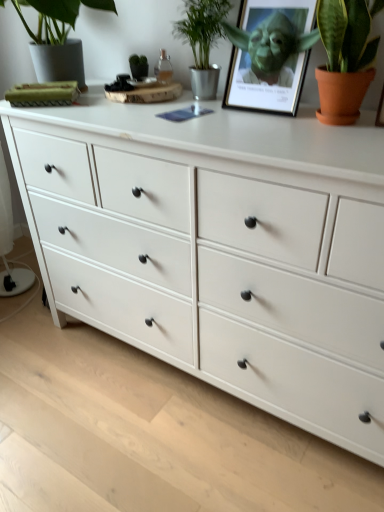
Question: From the image's perspective, is matte green picture frame at upper center over green metallic plant at upper center, the 2th houseplant positioned from the left?

Choices:
 (A) yes
 (B) no

Answer: (B)

Question: Are matte green picture frame at upper center and green metallic plant at upper center, arranged as the second houseplant when viewed from the right, far apart?

Choices:
 (A) yes
 (B) no

Answer: (B)

Question: Is matte green picture frame at upper center next to green metallic plant at upper center, the 2th houseplant positioned from the left?

Choices:
 (A) no
 (B) yes

Answer: (A)

Question: Is matte green picture frame at upper center wider than green metallic plant at upper center, the 2th houseplant positioned from the left?

Choices:
 (A) no
 (B) yes

Answer: (A)

Question: Does matte green picture frame at upper center have a greater height compared to green metallic plant at upper center, the 2th houseplant positioned from the left?

Choices:
 (A) no
 (B) yes

Answer: (A)

Question: From the image's perspective, is matte green picture frame at upper center located beneath green metallic plant at upper center, the 2th houseplant positioned from the left?

Choices:
 (A) no
 (B) yes

Answer: (B)

Question: Is matte green picture frame at upper center thinner than terracotta clay pot at upper right, the third houseplant in the left-to-right sequence?

Choices:
 (A) yes
 (B) no

Answer: (A)

Question: Can you confirm if matte green picture frame at upper center is positioned to the right of terracotta clay pot at upper right, the third houseplant in the left-to-right sequence?

Choices:
 (A) no
 (B) yes

Answer: (A)

Question: Is matte green picture frame at upper center wider than terracotta clay pot at upper right, acting as the first houseplant starting from the right?

Choices:
 (A) yes
 (B) no

Answer: (B)

Question: Considering the relative positions of matte green picture frame at upper center and terracotta clay pot at upper right, the third houseplant in the left-to-right sequence, in the image provided, is matte green picture frame at upper center to the left of terracotta clay pot at upper right, the third houseplant in the left-to-right sequence, from the viewer's perspective?

Choices:
 (A) no
 (B) yes

Answer: (B)

Question: Is matte green picture frame at upper center aimed at terracotta clay pot at upper right, the third houseplant in the left-to-right sequence?

Choices:
 (A) no
 (B) yes

Answer: (A)

Question: From the image's perspective, is matte green picture frame at upper center located beneath terracotta clay pot at upper right, acting as the first houseplant starting from the right?

Choices:
 (A) no
 (B) yes

Answer: (A)

Question: Is green metallic plant at upper center, the 2th houseplant positioned from the left, far from matte green picture frame at upper center?

Choices:
 (A) yes
 (B) no

Answer: (B)